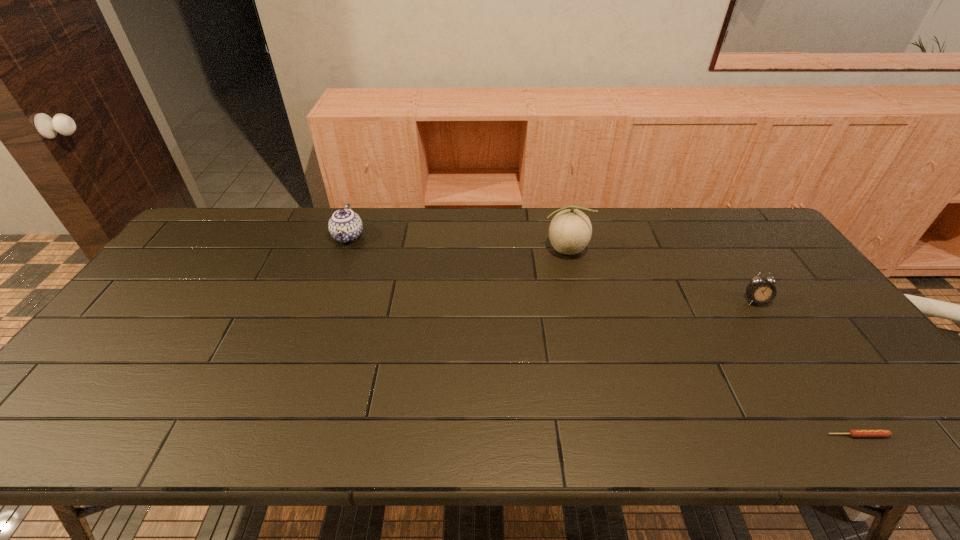
Where is `free space located on the face of the alarm clock`? free space located on the face of the alarm clock is located at coordinates (841, 431).

I want to click on vacant region located 0.120m on the left of the nearest object, so click(771, 435).

You are a GUI agent. You are given a task and a screenshot of the screen. Output one action in this format:
    pyautogui.click(x=<x>, y=<y>)
    Task: Click on the cantaloup that is at the far edge
    This screenshot has width=960, height=540.
    Given the screenshot: What is the action you would take?
    click(570, 231)

In order to click on chinaware at the far edge in this screenshot , I will do `click(345, 226)`.

Find the location of `object present at the near edge`. object present at the near edge is located at coordinates (856, 433).

This screenshot has width=960, height=540. What are the coordinates of `alarm clock that is at the right edge` in the screenshot? It's located at (759, 290).

Image resolution: width=960 pixels, height=540 pixels. Find the location of `sausage that is positioned at the right edge`. sausage that is positioned at the right edge is located at coordinates (856, 433).

Image resolution: width=960 pixels, height=540 pixels. What are the coordinates of `object at the near right corner` in the screenshot? It's located at (856, 433).

I want to click on free space at the far edge, so click(614, 241).

Where is `vacant space at the near edge of the desktop`? Image resolution: width=960 pixels, height=540 pixels. vacant space at the near edge of the desktop is located at coordinates (640, 410).